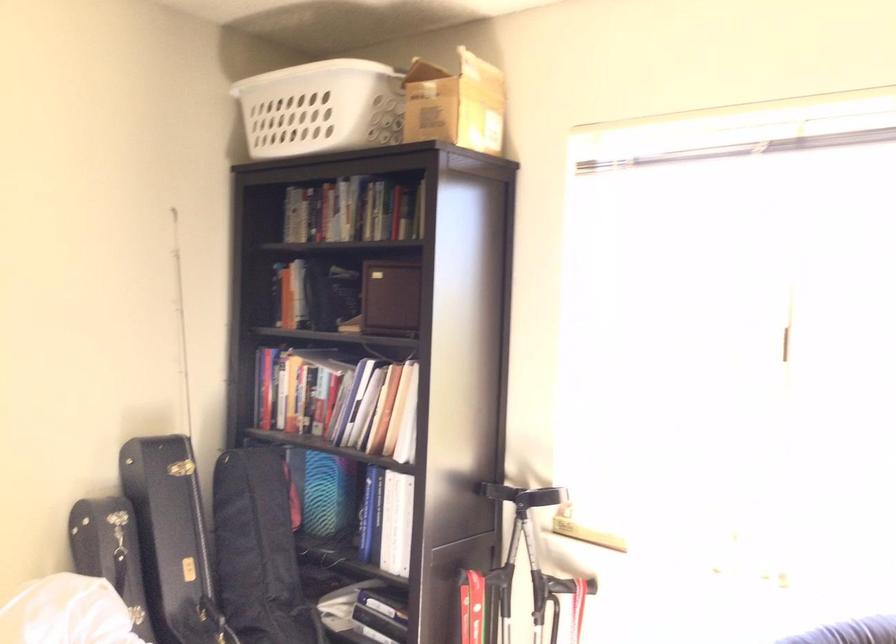
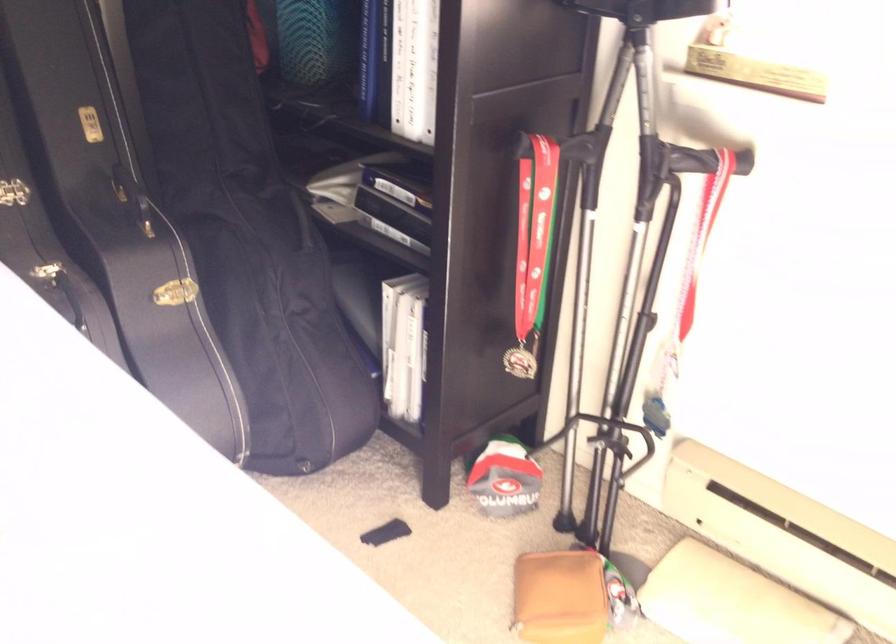
Question: How did the camera likely rotate?

Choices:
 (A) Left
 (B) Right
 (C) Up
 (D) Down

Answer: (D)